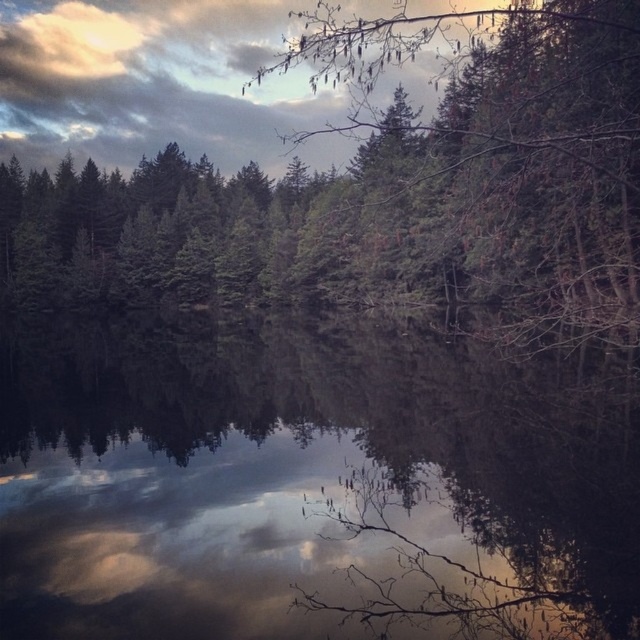
You are an artist trying to paint this scene. You want to ensure the glossy reflective water at center and the green matte tree at upper center are proportionally accurate. Which object should you make narrower in your painting?

The glossy reflective water at center should be made narrower since it is thinner than the green matte tree at upper center in the scene.

You are standing at the edge of the water and want to know which object in the scene is taller. Looking at the glossy reflective water at center and the green matte tree at upper center, which one has a greater height?

The green matte tree at upper center has a greater height than the glossy reflective water at center.